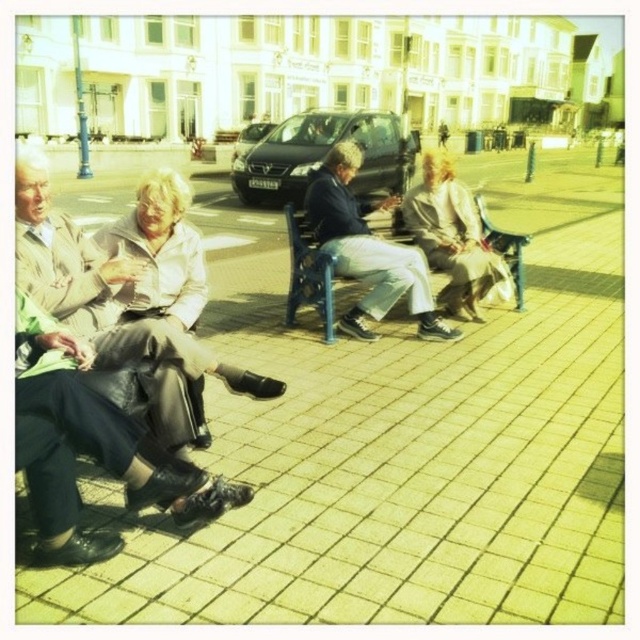
You are standing in the public square and want to walk to the yellow brick pavement at center. Which direction should you move relative to the light beige leather jacket at left?

You should move forward towards the yellow brick pavement at center since it is in front of the light beige leather jacket at left.